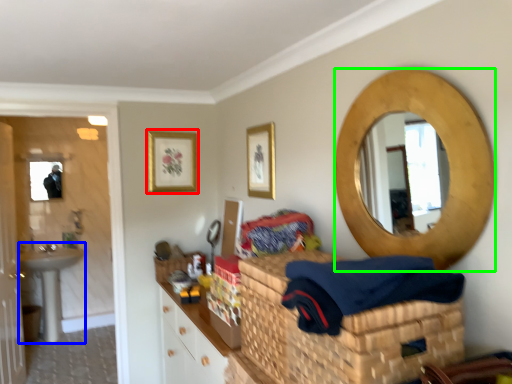
Question: Which is nearer to the picture frame (highlighted by a red box)? sink (highlighted by a blue box) or oval (highlighted by a green box).

Choices:
 (A) sink
 (B) oval

Answer: (B)